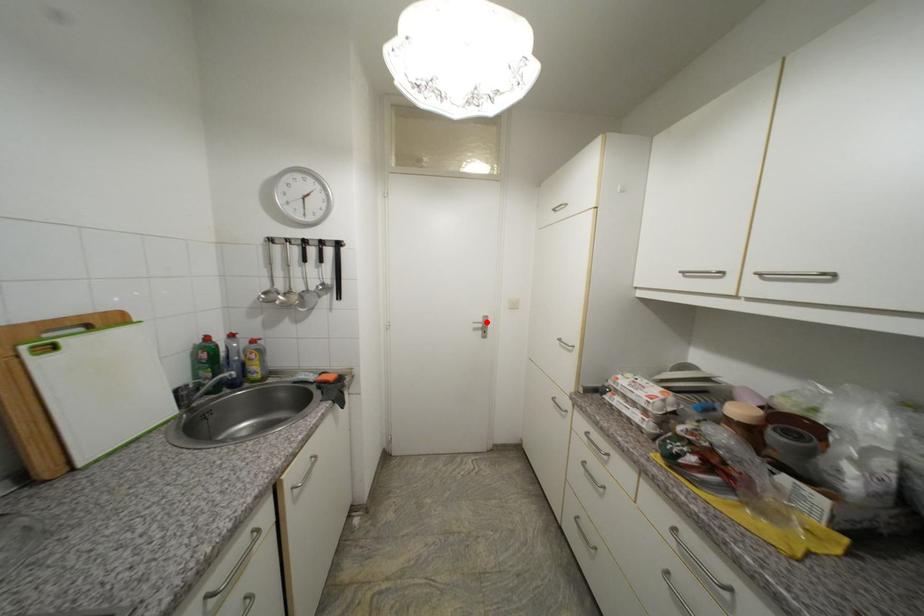
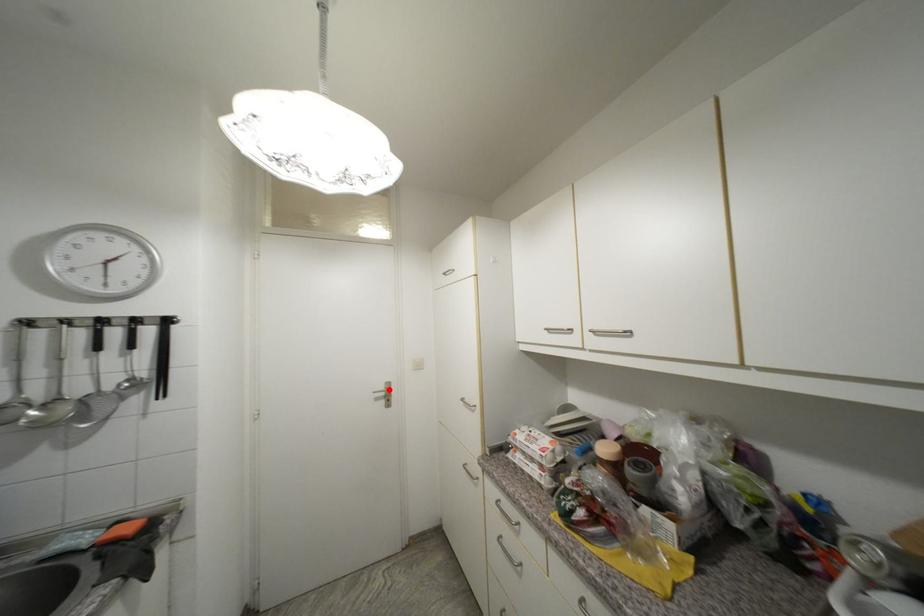
I am providing you with two images of the same scene from different viewpoints. A red point is marked on the first image and another point is marked on the second image. Is the marked point in image1 the same physical position as the marked point in image2?

Yes